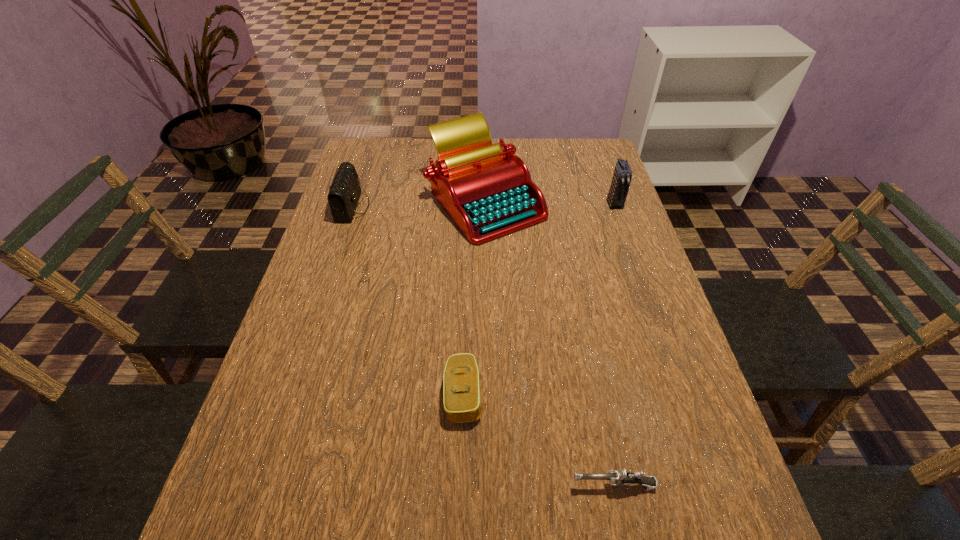
Identify the location of the tallest object. (487, 190).

This screenshot has width=960, height=540. I want to click on the tallest clutch bag, so click(x=622, y=175).

I want to click on the rightmost clutch bag, so click(622, 175).

Image resolution: width=960 pixels, height=540 pixels. I want to click on the second tallest clutch bag, so click(344, 192).

At what (x,y) coordinates should I click in order to perform the action: click on the leftmost clutch bag. Please return your answer as a coordinate pair (x, y). The width and height of the screenshot is (960, 540). Looking at the image, I should click on (344, 192).

You are a GUI agent. You are given a task and a screenshot of the screen. Output one action in this format:
    pyautogui.click(x=<x>, y=<y>)
    Task: Click on the fourth farthest object
    
    Given the screenshot: What is the action you would take?
    pyautogui.click(x=462, y=401)

Image resolution: width=960 pixels, height=540 pixels. I want to click on the nearest clutch bag, so click(462, 401).

Where is `the nearest object`? Image resolution: width=960 pixels, height=540 pixels. the nearest object is located at coordinates pos(616,477).

Image resolution: width=960 pixels, height=540 pixels. What are the coordinates of `vacant space located on the typing side of the typewriter` in the screenshot? It's located at (488, 335).

Where is `vacant space located 0.390m with the zip open on the tallest clutch bag`? The image size is (960, 540). vacant space located 0.390m with the zip open on the tallest clutch bag is located at coordinates (653, 314).